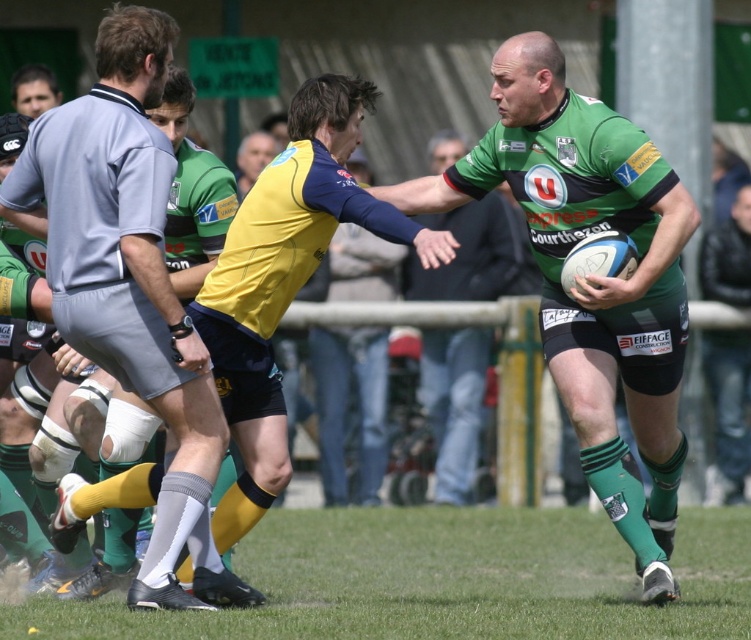
You are a sports analyst watching the rugby match. You notice the green jersey at center and the smooth gray shirt at upper left. Which player is positioned lower on the field?

The green jersey at center is positioned lower on the field than the smooth gray shirt at upper left.

You are a sports analyst watching the rugby match. You notice the green jersey at center and the smooth gray shirt at upper left. Based on their positions, which player is closer to the midfield line?

The green jersey at center is closer to the midfield line because it is positioned to the right of the smooth gray shirt at upper left, which is further away from midfield.